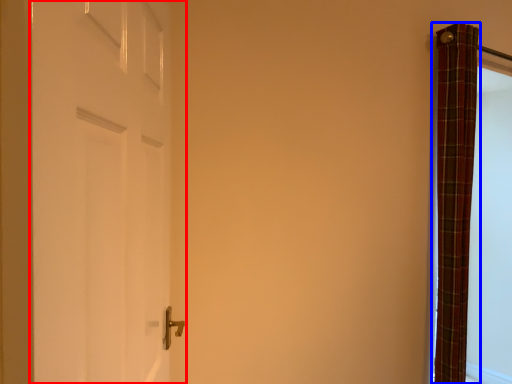
Question: Which of the following is the closest to the observer, door (highlighted by a red box) or curtain (highlighted by a blue box)?

Choices:
 (A) door
 (B) curtain

Answer: (A)